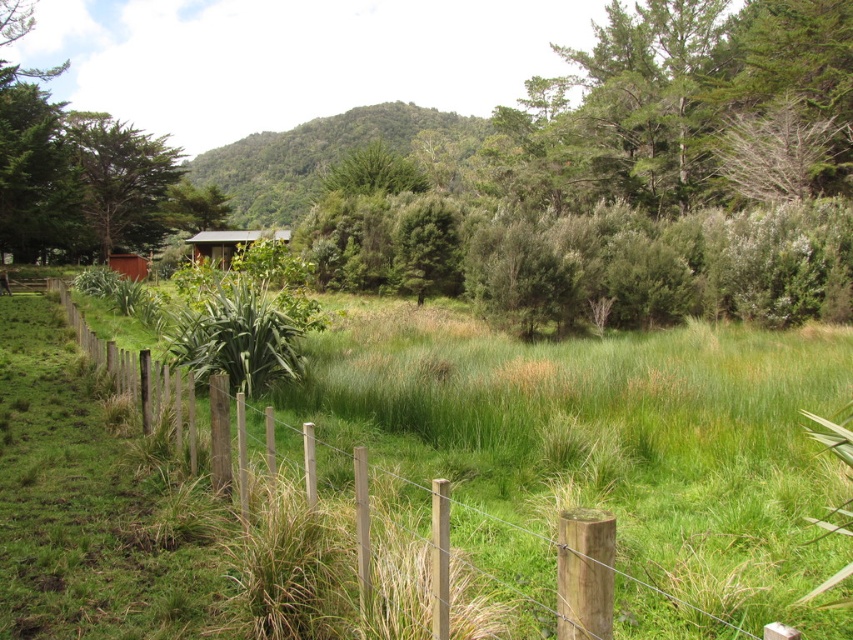
You are standing at point (143, 272) and want to walk to point (115, 122). Which direction should you face to move towards your destination?

You should face towards the direction of point (115, 122), which is behind point (143, 272). Since point (115, 122) is behind point (143, 272), you should turn around and walk in the opposite direction from your current position to reach your destination.

You are standing at the origin point of the coordinate system in the image. Which direction should you move to reach the green textured tree at upper left?

You should move towards the upper left direction to reach the green textured tree at upper left, as it is located at point (120, 179) in the coordinate system.

You are standing in the rural landscape and want to walk to the wooden hut at center. There is a green leafy shrub at center in your way. Which object should you move past first?

You should move past the green leafy shrub at center first because it is closer to you than the wooden hut at center.